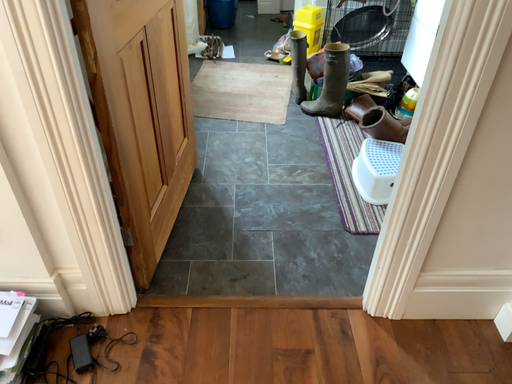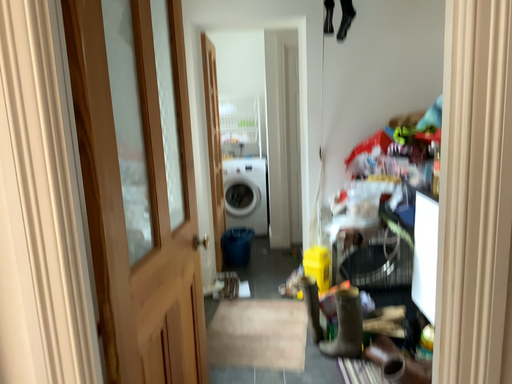
Question: Which way did the camera rotate in the video?

Choices:
 (A) rotated downward
 (B) rotated upward

Answer: (B)